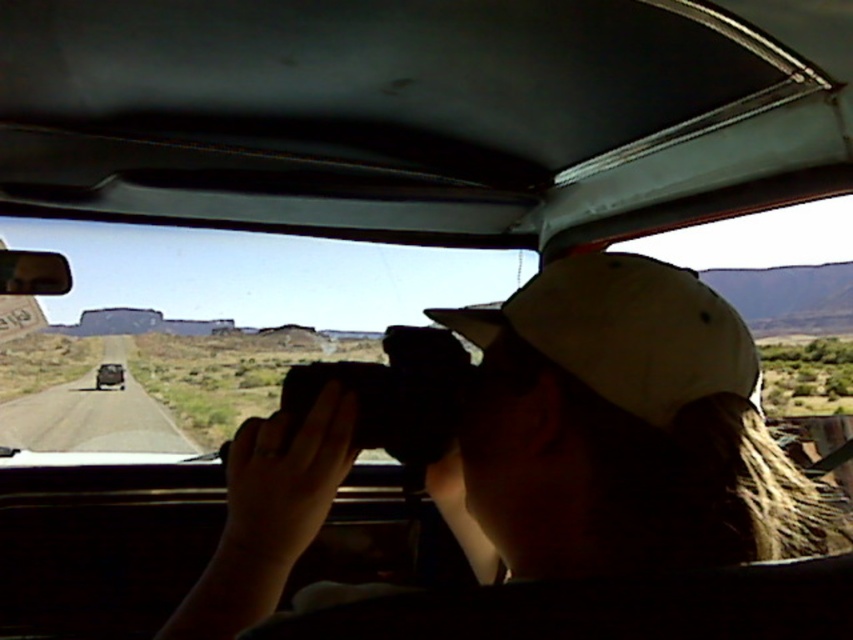
You are a photographer trying to capture a landscape through the transparent glass car window at center using the black matte camera at center. Given that the camera requires a minimum distance of 2 meters to focus properly, will you be able to take a clear photo through the window?

The transparent glass car window at center is 2.82 meters from the black matte camera at center. Since the required minimum distance is 2 meters, the camera can focus properly, so yes, you can take a clear photo through the window.

You are a passenger in the car and want to see the road ahead clearly. Which object, the transparent glass car window at center or the white matte baseball hat at center, should you look through to have a better view?

You should look through the transparent glass car window at center because its width surpasses that of the white matte baseball hat at center, providing a wider and clearer view of the road ahead.